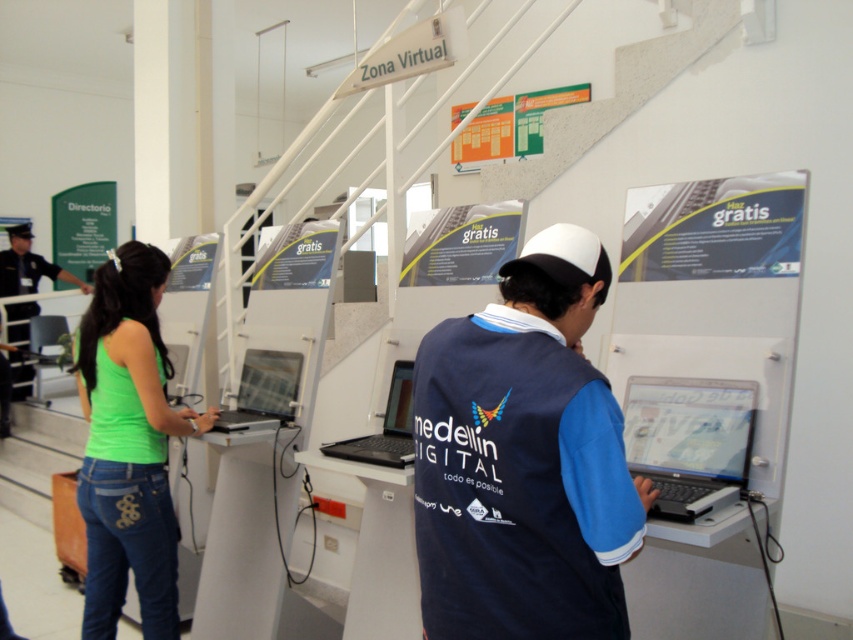
Question: Is blue fabric vest at center further to camera compared to matte black laptop at center?

Choices:
 (A) no
 (B) yes

Answer: (A)

Question: Which point is closer to the camera taking this photo?

Choices:
 (A) (445, 593)
 (B) (245, 412)
 (C) (93, 320)

Answer: (A)

Question: Does black matte laptop at center appear on the right side of dark blue uniform at left?

Choices:
 (A) no
 (B) yes

Answer: (B)

Question: Which of the following is the farthest from the observer?

Choices:
 (A) blue fabric vest at center
 (B) green denim jeans at lower left
 (C) silver metallic laptop at center
 (D) black matte laptop at center

Answer: (C)

Question: Is silver metallic laptop at center to the right of black matte laptop at center from the viewer's perspective?

Choices:
 (A) no
 (B) yes

Answer: (A)

Question: Estimate the real-world distances between objects in this image. Which object is closer to the matte black laptop at center?

Choices:
 (A) blue fabric vest at center
 (B) silver metallic laptop at center
 (C) black matte laptop at center
 (D) dark blue uniform at left

Answer: (A)